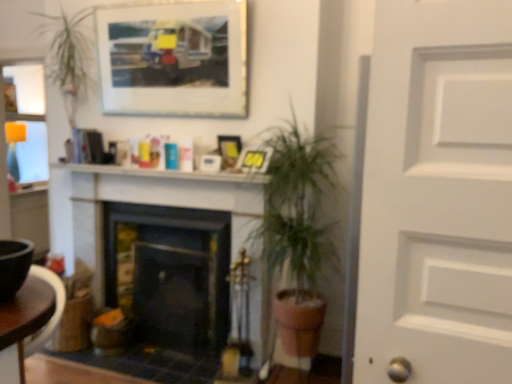
Question: Is white glossy mantel at upper center further to camera compared to matte plastic picture frame at center, which ranks as the second picture frame in bottom-to-top order?

Choices:
 (A) yes
 (B) no

Answer: (B)

Question: Is white glossy mantel at upper center at the right side of matte plastic picture frame at center, positioned as the second picture frame in top-to-bottom order?

Choices:
 (A) yes
 (B) no

Answer: (B)

Question: From a real-world perspective, does white glossy mantel at upper center stand above matte plastic picture frame at center, which ranks as the second picture frame in bottom-to-top order?

Choices:
 (A) no
 (B) yes

Answer: (A)

Question: Is white glossy mantel at upper center wider than matte plastic picture frame at center, positioned as the second picture frame in top-to-bottom order?

Choices:
 (A) no
 (B) yes

Answer: (B)

Question: Is white glossy mantel at upper center shorter than matte plastic picture frame at center, positioned as the second picture frame in top-to-bottom order?

Choices:
 (A) no
 (B) yes

Answer: (B)

Question: Considering the relative positions of matte plastic picture frame at upper center, the first picture frame in the bottom-to-top sequence, and brown wooden table at lower left in the image provided, is matte plastic picture frame at upper center, the first picture frame in the bottom-to-top sequence, to the left or to the right of brown wooden table at lower left?

Choices:
 (A) left
 (B) right

Answer: (B)

Question: From a real-world perspective, is matte plastic picture frame at upper center, which ranks as the 3th picture frame in top-to-bottom order, above or below brown wooden table at lower left?

Choices:
 (A) above
 (B) below

Answer: (A)

Question: In terms of size, does matte plastic picture frame at upper center, the first picture frame in the bottom-to-top sequence, appear bigger or smaller than brown wooden table at lower left?

Choices:
 (A) small
 (B) big

Answer: (A)

Question: From the image's perspective, relative to brown wooden table at lower left, is matte plastic picture frame at upper center, which ranks as the 3th picture frame in top-to-bottom order, above or below?

Choices:
 (A) below
 (B) above

Answer: (B)

Question: Considering the relative positions of wooden frame at upper center, which is the 3th picture frame from bottom to top, and brown wooden table at lower left in the image provided, is wooden frame at upper center, which is the 3th picture frame from bottom to top, to the left or to the right of brown wooden table at lower left?

Choices:
 (A) left
 (B) right

Answer: (B)

Question: Relative to brown wooden table at lower left, is wooden frame at upper center, which appears as the 1th picture frame when viewed from the top, in front or behind?

Choices:
 (A) front
 (B) behind

Answer: (B)

Question: From the image's perspective, relative to brown wooden table at lower left, is wooden frame at upper center, which is the 3th picture frame from bottom to top, above or below?

Choices:
 (A) above
 (B) below

Answer: (A)

Question: Which is correct: wooden frame at upper center, which appears as the 1th picture frame when viewed from the top, is inside brown wooden table at lower left, or outside of it?

Choices:
 (A) outside
 (B) inside

Answer: (A)

Question: From a real-world perspective, is black matte fireplace at center, which appears as the 2th fireplace when viewed from the left, positioned above or below wooden frame at upper center, which is the 3th picture frame from bottom to top?

Choices:
 (A) above
 (B) below

Answer: (B)

Question: Looking at the image, does black matte fireplace at center, placed as the first fireplace when sorted from right to left, seem bigger or smaller compared to wooden frame at upper center, which appears as the 1th picture frame when viewed from the top?

Choices:
 (A) big
 (B) small

Answer: (A)